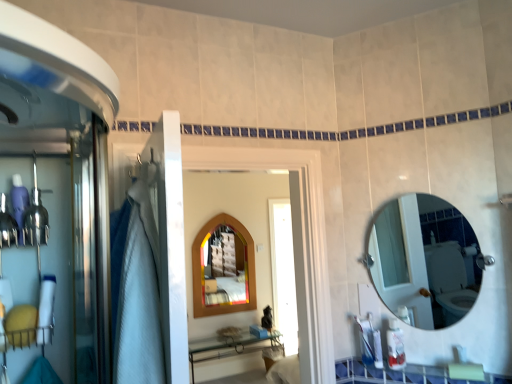
In order to face translucent plastic bottle at lower right, should I rotate leftwards or rightwards?

Turn right approximately 18.363 degrees to face it.

You are a GUI agent. You are given a task and a screenshot of the screen. Output one action in this format:
    pyautogui.click(x=<x>, y=<y>)
    Task: Click on the wooden stained mirror at center, the 2th mirror positioned from the front
    
    Given the screenshot: What is the action you would take?
    pyautogui.click(x=224, y=268)

The height and width of the screenshot is (384, 512). Find the location of `wooden arched mirror at center`. wooden arched mirror at center is located at coordinates (293, 238).

The image size is (512, 384). In order to click on translucent plastic bottle at lower right in this screenshot , I will do `click(395, 346)`.

Is wooden stained mirror at center, which appears as the first mirror when viewed from the left, not close to clear glass mirror at upper right, the 2th mirror positioned from the left?

Absolutely, wooden stained mirror at center, which appears as the first mirror when viewed from the left, is distant from clear glass mirror at upper right, the 2th mirror positioned from the left.

From a real-world perspective, which object rests below the other?

wooden stained mirror at center, the first mirror in the back-to-front sequence.

Looking at this image, considering the relative positions of wooden stained mirror at center, the first mirror in the back-to-front sequence, and clear glass mirror at upper right, the 2th mirror positioned from the left, in the image provided, is wooden stained mirror at center, the first mirror in the back-to-front sequence, to the left of clear glass mirror at upper right, the 2th mirror positioned from the left, from the viewer's perspective?

Indeed, wooden stained mirror at center, the first mirror in the back-to-front sequence, is positioned on the left side of clear glass mirror at upper right, the 2th mirror positioned from the left.

Is wooden stained mirror at center, the first mirror in the back-to-front sequence, positioned beyond the bounds of clear glass mirror at upper right, the 2th mirror positioned from the left?

Absolutely, wooden stained mirror at center, the first mirror in the back-to-front sequence, is external to clear glass mirror at upper right, the 2th mirror positioned from the left.

Locate an element on the screen. toiletry on the left side of white glossy counter top at lower center is located at coordinates pos(395,346).

Looking at this image, from a real-world perspective, which is physically below, white glossy counter top at lower center or translucent plastic bottle at lower right?

In real-world perspective, white glossy counter top at lower center is lower.

Looking at this image, considering the positions of objects white glossy counter top at lower center and translucent plastic bottle at lower right in the image provided, who is behind, white glossy counter top at lower center or translucent plastic bottle at lower right?

translucent plastic bottle at lower right is behind.

Which object is thinner, wooden stained mirror at center, the first mirror in the back-to-front sequence, or wooden arched mirror at center?

Thinner between the two is wooden stained mirror at center, the first mirror in the back-to-front sequence.

Is wooden stained mirror at center, the 2th mirror positioned from the front, beside wooden arched mirror at center?

No, wooden stained mirror at center, the 2th mirror positioned from the front, is not next to wooden arched mirror at center.

Is wooden stained mirror at center, the first mirror in the back-to-front sequence, facing away from wooden arched mirror at center?

No, wooden arched mirror at center is not at the back of wooden stained mirror at center, the first mirror in the back-to-front sequence.

Which of these two, wooden stained mirror at center, the 2th mirror positioned from the front, or wooden arched mirror at center, stands shorter?

wooden arched mirror at center is shorter.

Is wooden arched mirror at center aimed at translucent plastic bottle at lower right?

No.

Does wooden arched mirror at center have a larger size compared to translucent plastic bottle at lower right?

Yes, wooden arched mirror at center is bigger than translucent plastic bottle at lower right.

Which is farther from the camera, (253, 155) or (399, 350)?

The point (399, 350) is more distant.

From the image's perspective, is wooden arched mirror at center under translucent plastic bottle at lower right?

Actually, wooden arched mirror at center appears above translucent plastic bottle at lower right in the image.

Is wooden stained mirror at center, the first mirror in the back-to-front sequence, situated inside translucent plastic bottle at lower right or outside?

wooden stained mirror at center, the first mirror in the back-to-front sequence, is not inside translucent plastic bottle at lower right, it's outside.

Which of these two, wooden stained mirror at center, the 2th mirror positioned from the front, or translucent plastic bottle at lower right, is smaller?

translucent plastic bottle at lower right is smaller.

Are wooden stained mirror at center, the first mirror in the back-to-front sequence, and translucent plastic bottle at lower right making contact?

They are not placed beside each other.

In the scene shown: How different are the orientations of wooden stained mirror at center, the second mirror from the right, and white glossy counter top at lower center in degrees?

The angle between the facing direction of wooden stained mirror at center, the second mirror from the right, and the facing direction of white glossy counter top at lower center is 55.1 degrees.

Between wooden stained mirror at center, which appears as the first mirror when viewed from the left, and white glossy counter top at lower center, which one has smaller width?

Thinner between the two is wooden stained mirror at center, which appears as the first mirror when viewed from the left.

From the picture: Between wooden stained mirror at center, the second mirror from the right, and white glossy counter top at lower center, which one has more height?

Standing taller between the two is wooden stained mirror at center, the second mirror from the right.

Is wooden stained mirror at center, the 2th mirror positioned from the front, bigger than white glossy counter top at lower center?

Indeed, wooden stained mirror at center, the 2th mirror positioned from the front, has a larger size compared to white glossy counter top at lower center.

Is clear glass mirror at upper right, the 2th mirror positioned from the left, shorter than translucent plastic bottle at lower right?

No.

Consider the image. Considering the relative sizes of clear glass mirror at upper right, the first mirror positioned from the right, and translucent plastic bottle at lower right in the image provided, is clear glass mirror at upper right, the first mirror positioned from the right, bigger than translucent plastic bottle at lower right?

Correct, clear glass mirror at upper right, the first mirror positioned from the right, is larger in size than translucent plastic bottle at lower right.

The height and width of the screenshot is (384, 512). There is a translucent plastic bottle at lower right. What are the coordinates of `the 2nd mirror above it (from a real-world perspective)` in the screenshot? It's located at (424, 260).

Can you see clear glass mirror at upper right, the first mirror positioned from the right, touching translucent plastic bottle at lower right?

No, clear glass mirror at upper right, the first mirror positioned from the right, is not in contact with translucent plastic bottle at lower right.

You are a GUI agent. You are given a task and a screenshot of the screen. Output one action in this format:
    pyautogui.click(x=<x>, y=<y>)
    Task: Click on the mirror that appears below the clear glass mirror at upper right, the 2th mirror positioned from the left (from a real-world perspective)
    The width and height of the screenshot is (512, 384).
    Given the screenshot: What is the action you would take?
    pyautogui.click(x=224, y=268)

Identify the location of toiletry to the left of white glossy counter top at lower center. (395, 346).

When comparing their distances from white glossy counter top at lower center, does translucent plastic bottle at lower right or wooden stained mirror at center, the 2th mirror positioned from the front, seem closer?

Among the two, translucent plastic bottle at lower right is located nearer to white glossy counter top at lower center.

From the image, which object appears to be farther from wooden stained mirror at center, the 2th mirror positioned from the front, translucent plastic bottle at lower right or wooden arched mirror at center?

Among the two, translucent plastic bottle at lower right is located further to wooden stained mirror at center, the 2th mirror positioned from the front.

Looking at the image, which one is located closer to clear glass mirror at upper right, the first mirror positioned from the right, wooden stained mirror at center, which appears as the first mirror when viewed from the left, or wooden arched mirror at center?

Among the two, wooden stained mirror at center, which appears as the first mirror when viewed from the left, is located nearer to clear glass mirror at upper right, the first mirror positioned from the right.

From the image, which object appears to be nearer to translucent plastic bottle at lower right, clear glass mirror at upper right, which appears as the 1th mirror when viewed from the front, or wooden stained mirror at center, the first mirror in the back-to-front sequence?

The object closer to translucent plastic bottle at lower right is clear glass mirror at upper right, which appears as the 1th mirror when viewed from the front.

Which object lies nearer to the anchor point wooden stained mirror at center, the 2th mirror positioned from the front, wooden arched mirror at center or clear glass mirror at upper right, which ranks as the 2th mirror in back-to-front order?

Based on the image, clear glass mirror at upper right, which ranks as the 2th mirror in back-to-front order, appears to be nearer to wooden stained mirror at center, the 2th mirror positioned from the front.

Considering their positions, is wooden arched mirror at center positioned closer to white glossy counter top at lower center than wooden stained mirror at center, the second mirror from the right?

wooden arched mirror at center is positioned closer to the anchor white glossy counter top at lower center.

Estimate the real-world distances between objects in this image. Which object is further from clear glass mirror at upper right, the first mirror positioned from the right, wooden arched mirror at center or wooden stained mirror at center, the second mirror from the right?

wooden arched mirror at center lies further to clear glass mirror at upper right, the first mirror positioned from the right, than the other object.

Considering their positions, is wooden stained mirror at center, the second mirror from the right, positioned further to white glossy counter top at lower center than clear glass mirror at upper right, which appears as the 1th mirror when viewed from the front?

wooden stained mirror at center, the second mirror from the right, lies further to white glossy counter top at lower center than the other object.

Where is `mirror positioned between white glossy counter top at lower center and wooden stained mirror at center, the second mirror from the right, from near to far`? mirror positioned between white glossy counter top at lower center and wooden stained mirror at center, the second mirror from the right, from near to far is located at coordinates (424, 260).

Where is `toiletry between clear glass mirror at upper right, the 2th mirror positioned from the left, and wooden stained mirror at center, the 2th mirror positioned from the front, in the front-back direction`? The height and width of the screenshot is (384, 512). toiletry between clear glass mirror at upper right, the 2th mirror positioned from the left, and wooden stained mirror at center, the 2th mirror positioned from the front, in the front-back direction is located at coordinates (395, 346).

I want to click on toiletry between clear glass mirror at upper right, the 2th mirror positioned from the left, and white glossy counter top at lower center in the up-down direction, so click(395, 346).

Where is `screen door located between white glossy counter top at lower center and wooden stained mirror at center, the second mirror from the right, in the depth direction`? This screenshot has height=384, width=512. screen door located between white glossy counter top at lower center and wooden stained mirror at center, the second mirror from the right, in the depth direction is located at coordinates (293, 238).